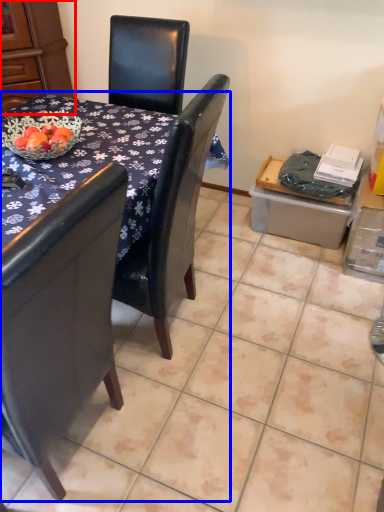
Question: Which of the following is the farthest to the observer, armoire (highlighted by a red box) or table (highlighted by a blue box)?

Choices:
 (A) armoire
 (B) table

Answer: (A)